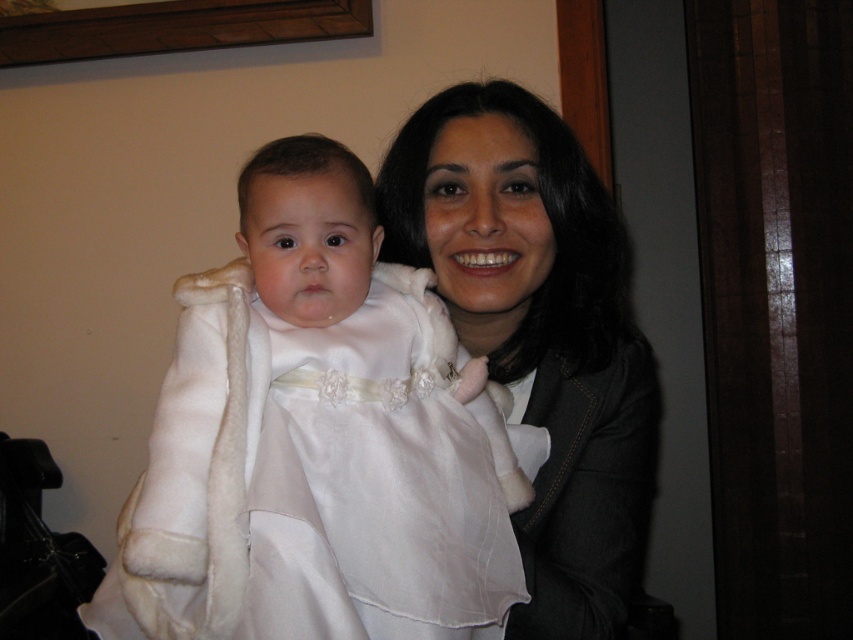
You are a photographer setting up a shoot in the described scene. You need to place a small prop exactly at the point marked as point (366, 426). What object is located at that point?

The white satin dress at center is located at point (366, 426).

You are a photographer setting up for a family portrait. You notice the white satin dress at center and the matte white coat at center. Which item should you focus on first if you want to capture the closest object to the camera?

The white satin dress at center is closer to the viewer than the matte white coat at center, so you should focus on the white satin dress at center first.

You are a photographer arranging two white garments for a photoshoot. You have a white satin dress at center and a matte white coat at center. According to the scene, which garment is positioned to the left?

The white satin dress at center is positioned to the left of the matte white coat at center.